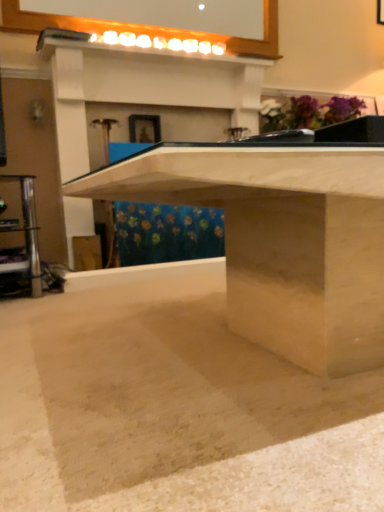
Identify the location of free space above smooth concrete at center (from a real-world perspective). click(152, 332).